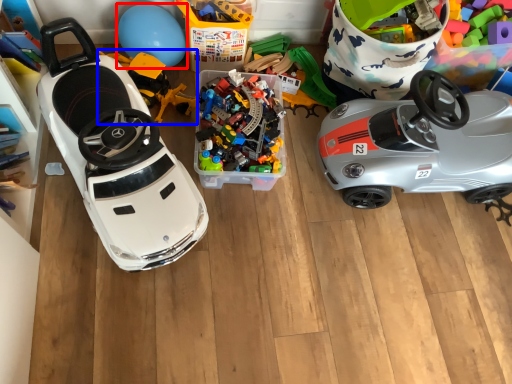
Question: Which point is closer to the camera, balloon (highlighted by a red box) or toy (highlighted by a blue box)?

Choices:
 (A) balloon
 (B) toy

Answer: (B)